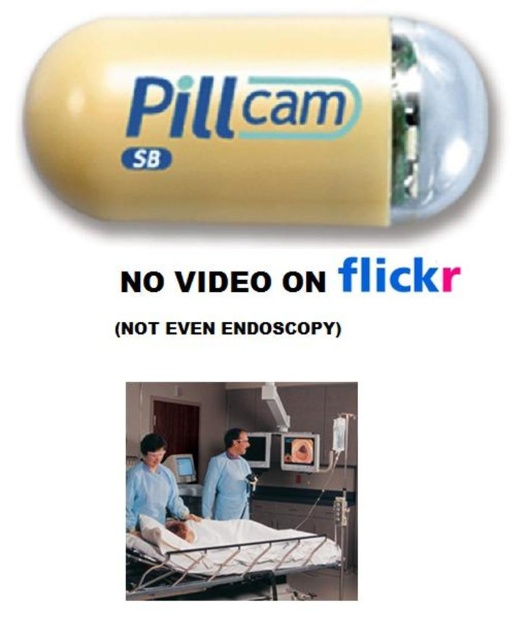
You are a medical technician analyzing an image. You see two points labeled as point 1 at coordinates (287, 540) and point 2 at (153, 480). Which point is closer to you?

Point 1 at coordinates (287, 540) is closer to you than point 2 at (153, 480).

You are a patient in a doctor office. You see a point at coordinate (153, 486). Where is this point located?

The point at coordinate (153, 486) is on blue fabric doctor at center.